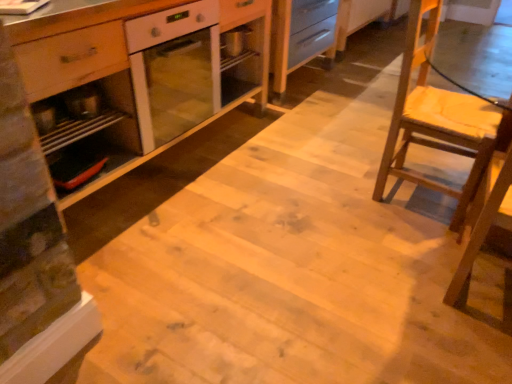
Question: Does wooden chair at right have a lesser width compared to metallic silver tray at left?

Choices:
 (A) no
 (B) yes

Answer: (A)

Question: Is wooden chair at right in contact with metallic silver tray at left?

Choices:
 (A) no
 (B) yes

Answer: (A)

Question: Is wooden chair at right shorter than metallic silver tray at left?

Choices:
 (A) yes
 (B) no

Answer: (B)

Question: From a real-world perspective, does wooden chair at right stand above metallic silver tray at left?

Choices:
 (A) no
 (B) yes

Answer: (A)

Question: Considering the relative positions of wooden chair at right and metallic silver tray at left in the image provided, is wooden chair at right to the right of metallic silver tray at left from the viewer's perspective?

Choices:
 (A) no
 (B) yes

Answer: (B)

Question: Considering the relative sizes of wooden chair at right and metallic silver tray at left in the image provided, is wooden chair at right wider than metallic silver tray at left?

Choices:
 (A) yes
 (B) no

Answer: (A)

Question: Is wooden chair at right surrounded by metallic silver tray at left?

Choices:
 (A) no
 (B) yes

Answer: (A)

Question: Is metallic silver tray at left shorter than wooden chair at right?

Choices:
 (A) yes
 (B) no

Answer: (A)

Question: Does metallic silver tray at left have a lesser width compared to wooden chair at right?

Choices:
 (A) yes
 (B) no

Answer: (A)

Question: Is metallic silver tray at left further to camera compared to wooden chair at right?

Choices:
 (A) yes
 (B) no

Answer: (A)

Question: From the image's perspective, is metallic silver tray at left below wooden chair at right?

Choices:
 (A) yes
 (B) no

Answer: (A)

Question: Is metallic silver tray at left oriented towards wooden chair at right?

Choices:
 (A) no
 (B) yes

Answer: (A)

Question: Is white glossy oven at center turned away from wooden chair at right?

Choices:
 (A) no
 (B) yes

Answer: (A)